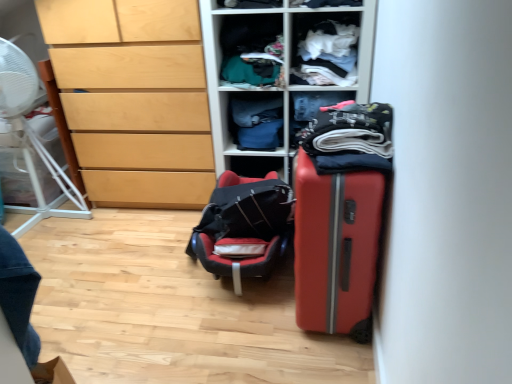
In order to click on vacant area located to the right-hand side of white plastic fan at left in this screenshot , I will do `click(125, 232)`.